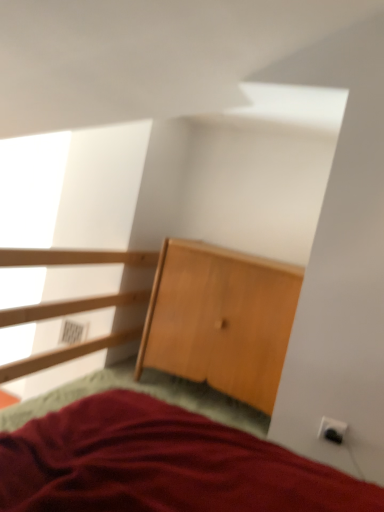
This screenshot has width=384, height=512. What do you see at coordinates (221, 319) in the screenshot?
I see `light brown wooden dresser at center` at bounding box center [221, 319].

This screenshot has height=512, width=384. What do you see at coordinates (72, 332) in the screenshot? I see `white plastic electric outlet at lower right, the first electric outlet positioned from the top` at bounding box center [72, 332].

Locate an element on the screen. The height and width of the screenshot is (512, 384). transparent glass window at upper left is located at coordinates (101, 187).

Identify the location of light brown wooden dresser at center. This screenshot has width=384, height=512. (221, 319).

Can you confirm if transparent glass window at upper left is positioned to the right of white plastic electric outlet at lower right, which is the 1th electric outlet in left-to-right order?

Yes, transparent glass window at upper left is to the right of white plastic electric outlet at lower right, which is the 1th electric outlet in left-to-right order.

Where is `window screen in front of the white plastic electric outlet at lower right, the 2th electric outlet in the right-to-left sequence`? The image size is (384, 512). window screen in front of the white plastic electric outlet at lower right, the 2th electric outlet in the right-to-left sequence is located at coordinates (101, 187).

Can you confirm if transparent glass window at upper left is taller than white plastic electric outlet at lower right, marked as the 1th electric outlet in a back-to-front arrangement?

Indeed, transparent glass window at upper left has a greater height compared to white plastic electric outlet at lower right, marked as the 1th electric outlet in a back-to-front arrangement.

Are transparent glass window at upper left and white plastic electric outlet at lower right, placed as the second electric outlet when sorted from bottom to top, located far from each other?

No.

How much distance is there between white plastic electric outlet at lower right, arranged as the 2th electric outlet when viewed from the top, and light brown wooden dresser at center?

white plastic electric outlet at lower right, arranged as the 2th electric outlet when viewed from the top, is 26.45 inches away from light brown wooden dresser at center.

Based on the photo, is white plastic electric outlet at lower right, which is counted as the second electric outlet, starting from the left, wider or thinner than light brown wooden dresser at center?

Considering their sizes, white plastic electric outlet at lower right, which is counted as the second electric outlet, starting from the left, looks slimmer than light brown wooden dresser at center.

In the scene shown: Is white plastic electric outlet at lower right, arranged as the 2th electric outlet when viewed from the top, touching light brown wooden dresser at center?

No.

Does white plastic electric outlet at lower right, the first electric outlet when ordered from front to back, turn towards light brown wooden dresser at center?

No, white plastic electric outlet at lower right, the first electric outlet when ordered from front to back, is not facing towards light brown wooden dresser at center.

Is light brown wooden dresser at center wider than transparent glass window at upper left?

In fact, light brown wooden dresser at center might be narrower than transparent glass window at upper left.

From a real-world perspective, does light brown wooden dresser at center stand above transparent glass window at upper left?

Incorrect, from a real-world perspective, light brown wooden dresser at center is lower than transparent glass window at upper left.

Considering the relative sizes of light brown wooden dresser at center and transparent glass window at upper left in the image provided, is light brown wooden dresser at center taller than transparent glass window at upper left?

In fact, light brown wooden dresser at center may be shorter than transparent glass window at upper left.

Is light brown wooden dresser at center with transparent glass window at upper left?

light brown wooden dresser at center is not next to transparent glass window at upper left, and they're not touching.

Is point (82, 330) behind point (68, 167)?

That is False.

From a real-world perspective, is white plastic electric outlet at lower right, which is the 1th electric outlet in left-to-right order, physically above transparent glass window at upper left?

No.

Is white plastic electric outlet at lower right, the second electric outlet viewed from the front, in front of transparent glass window at upper left?

That is False.

Is white plastic electric outlet at lower right, the first electric outlet positioned from the top, not within transparent glass window at upper left?

white plastic electric outlet at lower right, the first electric outlet positioned from the top, lies outside transparent glass window at upper left's area.

Between white plastic electric outlet at lower right, which is the 1th electric outlet in left-to-right order, and light brown wooden dresser at center, which one has smaller width?

With smaller width is white plastic electric outlet at lower right, which is the 1th electric outlet in left-to-right order.

Is white plastic electric outlet at lower right, marked as the 1th electric outlet in a back-to-front arrangement, facing towards light brown wooden dresser at center?

No, white plastic electric outlet at lower right, marked as the 1th electric outlet in a back-to-front arrangement, is not aimed at light brown wooden dresser at center.

Who is smaller, white plastic electric outlet at lower right, marked as the 1th electric outlet in a back-to-front arrangement, or light brown wooden dresser at center?

With smaller size is white plastic electric outlet at lower right, marked as the 1th electric outlet in a back-to-front arrangement.

Is transparent glass window at upper left positioned with its back to white plastic electric outlet at lower right, arranged as the 2th electric outlet when viewed from the top?

transparent glass window at upper left does not have its back to white plastic electric outlet at lower right, arranged as the 2th electric outlet when viewed from the top.

From a real-world perspective, is transparent glass window at upper left located higher than white plastic electric outlet at lower right, placed as the 1th electric outlet when sorted from bottom to top?

Yes, from a real-world perspective, transparent glass window at upper left is over white plastic electric outlet at lower right, placed as the 1th electric outlet when sorted from bottom to top

Consider the image. From the image's perspective, is transparent glass window at upper left above or below white plastic electric outlet at lower right, the first electric outlet when ordered from front to back?

From the image's perspective, transparent glass window at upper left appears above white plastic electric outlet at lower right, the first electric outlet when ordered from front to back.

Considering the positions of objects transparent glass window at upper left and white plastic electric outlet at lower right, which is counted as the second electric outlet, starting from the left, in the image provided, who is more to the right, transparent glass window at upper left or white plastic electric outlet at lower right, which is counted as the second electric outlet, starting from the left,?

From the viewer's perspective, white plastic electric outlet at lower right, which is counted as the second electric outlet, starting from the left, appears more on the right side.

From the image's perspective, is transparent glass window at upper left located above or below light brown wooden dresser at center?

From the image's perspective, transparent glass window at upper left appears above light brown wooden dresser at center.

The height and width of the screenshot is (512, 384). In order to click on window screen above the light brown wooden dresser at center (from the image's perspective) in this screenshot , I will do `click(101, 187)`.

Could you tell me if transparent glass window at upper left is turned towards light brown wooden dresser at center?

No, transparent glass window at upper left does not turn towards light brown wooden dresser at center.

Looking at this image, from a real-world perspective, does transparent glass window at upper left stand above light brown wooden dresser at center?

Yes.

From the image's perspective, which electric outlet is the 1st one below the transparent glass window at upper left? Please provide its 2D coordinates.

[(72, 332)]

Where is `dresser above the white plastic electric outlet at lower right, the first electric outlet when ordered from front to back (from the image's perspective)`? dresser above the white plastic electric outlet at lower right, the first electric outlet when ordered from front to back (from the image's perspective) is located at coordinates (221, 319).

Considering their positions, is white plastic electric outlet at lower right, arranged as the first electric outlet when viewed from the right, positioned further to transparent glass window at upper left than white plastic electric outlet at lower right, the second electric outlet viewed from the front?

white plastic electric outlet at lower right, arranged as the first electric outlet when viewed from the right, is further to transparent glass window at upper left.

Looking at the image, which one is located further to light brown wooden dresser at center, white plastic electric outlet at lower right, the 2th electric outlet in the right-to-left sequence, or transparent glass window at upper left?

white plastic electric outlet at lower right, the 2th electric outlet in the right-to-left sequence, lies further to light brown wooden dresser at center than the other object.

When comparing their distances from white plastic electric outlet at lower right, arranged as the 2th electric outlet when viewed from the top, does transparent glass window at upper left or white plastic electric outlet at lower right, the 2th electric outlet in the right-to-left sequence, seem closer?

white plastic electric outlet at lower right, the 2th electric outlet in the right-to-left sequence, is positioned closer to the anchor white plastic electric outlet at lower right, arranged as the 2th electric outlet when viewed from the top.

Based on their spatial positions, is transparent glass window at upper left or white plastic electric outlet at lower right, which is counted as the second electric outlet, starting from the left, closer to white plastic electric outlet at lower right, the 2th electric outlet in the right-to-left sequence?

transparent glass window at upper left lies closer to white plastic electric outlet at lower right, the 2th electric outlet in the right-to-left sequence, than the other object.

Looking at the image, which one is located further to light brown wooden dresser at center, white plastic electric outlet at lower right, which is the 2th electric outlet from back to front, or white plastic electric outlet at lower right, placed as the second electric outlet when sorted from bottom to top?

white plastic electric outlet at lower right, placed as the second electric outlet when sorted from bottom to top.

In the scene shown: Considering their positions, is transparent glass window at upper left positioned further to light brown wooden dresser at center than white plastic electric outlet at lower right, the first electric outlet positioned from the top?

The object further to light brown wooden dresser at center is white plastic electric outlet at lower right, the first electric outlet positioned from the top.

Based on their spatial positions, is white plastic electric outlet at lower right, arranged as the 2th electric outlet when viewed from the top, or transparent glass window at upper left further from white plastic electric outlet at lower right, placed as the second electric outlet when sorted from bottom to top?

white plastic electric outlet at lower right, arranged as the 2th electric outlet when viewed from the top, lies further to white plastic electric outlet at lower right, placed as the second electric outlet when sorted from bottom to top, than the other object.

Looking at the image, which one is located further to transparent glass window at upper left, white plastic electric outlet at lower right, the first electric outlet positioned from the top, or white plastic electric outlet at lower right, arranged as the first electric outlet when viewed from the right?

Among the two, white plastic electric outlet at lower right, arranged as the first electric outlet when viewed from the right, is located further to transparent glass window at upper left.

Find the location of `dresser between white plastic electric outlet at lower right, which is the 1th electric outlet in left-to-right order, and white plastic electric outlet at lower right, which is the 2th electric outlet from back to front`. dresser between white plastic electric outlet at lower right, which is the 1th electric outlet in left-to-right order, and white plastic electric outlet at lower right, which is the 2th electric outlet from back to front is located at coordinates (221, 319).

Where is `dresser between transparent glass window at upper left and white plastic electric outlet at lower right, which is counted as the second electric outlet, starting from the left`? The height and width of the screenshot is (512, 384). dresser between transparent glass window at upper left and white plastic electric outlet at lower right, which is counted as the second electric outlet, starting from the left is located at coordinates (221, 319).

Where is `window screen between white plastic electric outlet at lower right, placed as the second electric outlet when sorted from bottom to top, and white plastic electric outlet at lower right, arranged as the 2th electric outlet when viewed from the top`? window screen between white plastic electric outlet at lower right, placed as the second electric outlet when sorted from bottom to top, and white plastic electric outlet at lower right, arranged as the 2th electric outlet when viewed from the top is located at coordinates (101, 187).

Locate an element on the screen. Image resolution: width=384 pixels, height=512 pixels. dresser positioned between transparent glass window at upper left and white plastic electric outlet at lower right, the first electric outlet positioned from the top, from near to far is located at coordinates (221, 319).